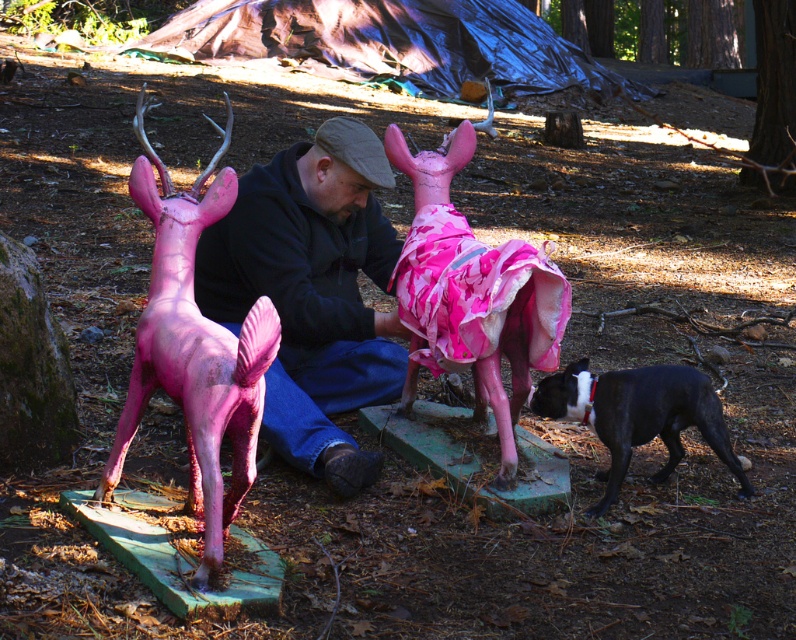
Can you confirm if matte black hoodie at center is bigger than black glossy dog at lower right?

Correct, matte black hoodie at center is larger in size than black glossy dog at lower right.

Who is taller, matte black hoodie at center or black glossy dog at lower right?

matte black hoodie at center is taller.

Where is `matte black hoodie at center`? This screenshot has height=640, width=796. matte black hoodie at center is located at coordinates (311, 292).

The height and width of the screenshot is (640, 796). What are the coordinates of `matte black hoodie at center` in the screenshot? It's located at (311, 292).

Can you confirm if matte black hoodie at center is wider than pink matte deer at center?

Correct, the width of matte black hoodie at center exceeds that of pink matte deer at center.

Is point (289, 371) positioned in front of point (551, 364)?

That is False.

I want to click on matte black hoodie at center, so click(x=311, y=292).

Does matte black hoodie at center have a greater width compared to matte pink plastic deer at left?

Indeed, matte black hoodie at center has a greater width compared to matte pink plastic deer at left.

Is the position of matte black hoodie at center less distant than that of matte pink plastic deer at left?

No, it is behind matte pink plastic deer at left.

Is point (353, 444) positioned before point (160, 337)?

No, it is behind (160, 337).

What are the coordinates of `matte black hoodie at center` in the screenshot? It's located at (311, 292).